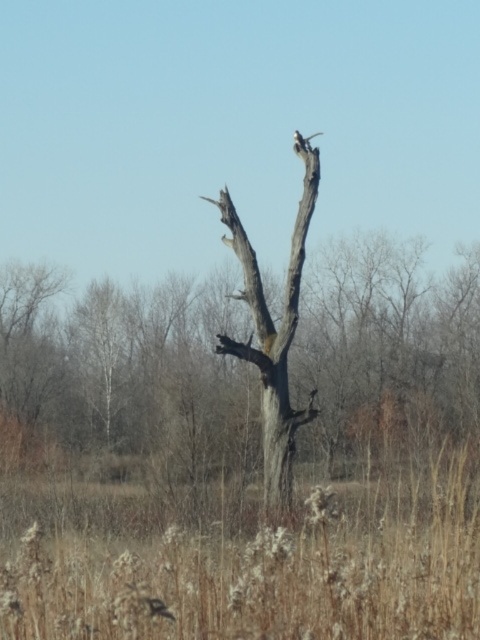
Question: Is brown dry grass at center bigger than gray rough bark tree at center?

Choices:
 (A) no
 (B) yes

Answer: (B)

Question: From the image, what is the correct spatial relationship of brown dry grass at center in relation to white feathered bird at upper center?

Choices:
 (A) left
 (B) right

Answer: (A)

Question: Does brown dry grass at center have a larger size compared to gray rough bark tree at center?

Choices:
 (A) yes
 (B) no

Answer: (A)

Question: Among these objects, which one is nearest to the camera?

Choices:
 (A) white feathered bird at upper center
 (B) brown dry grass at center
 (C) gray rough bark tree at center

Answer: (B)

Question: Which of the following is the closest to the observer?

Choices:
 (A) gray rough bark tree at center
 (B) brown dry grass at center

Answer: (B)

Question: Considering the real-world distances, which object is farthest from the white feathered bird at upper center?

Choices:
 (A) brown dry grass at center
 (B) gray rough bark tree at center

Answer: (A)